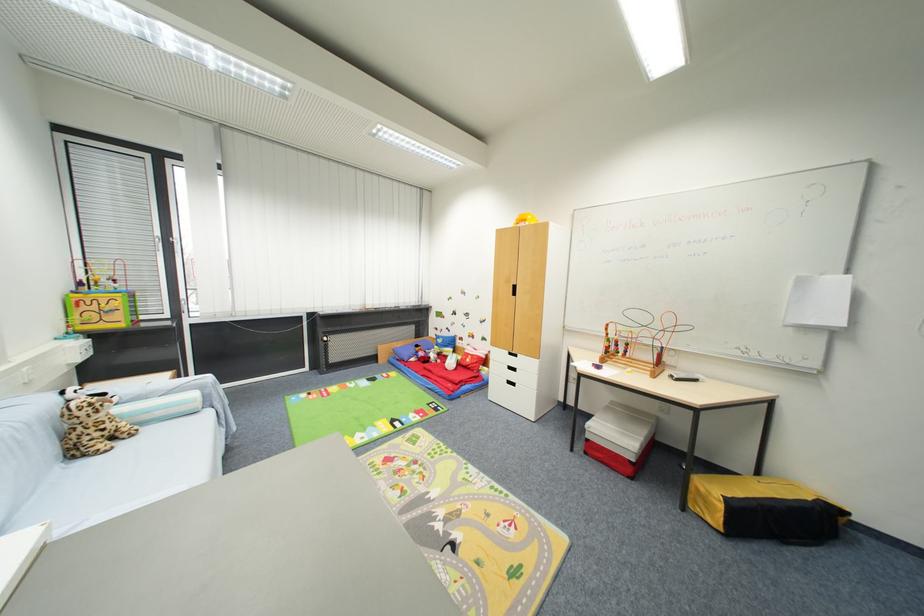
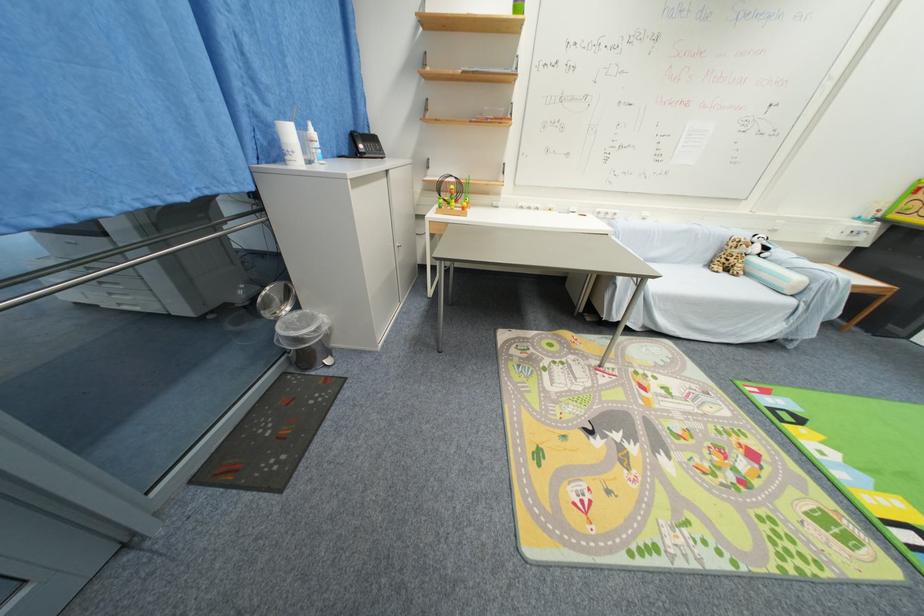
Find the pixel in the second image that matches point 79,456 in the first image.

(714, 265)